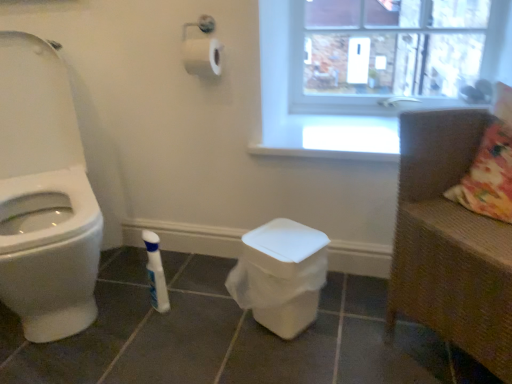
Question: Can you confirm if white glossy bottle at lower center is smaller than transparent plastic window screen at upper right?

Choices:
 (A) no
 (B) yes

Answer: (B)

Question: From the image's perspective, does white glossy bottle at lower center appear higher than transparent plastic window screen at upper right?

Choices:
 (A) yes
 (B) no

Answer: (B)

Question: Is transparent plastic window screen at upper right a part of white glossy bottle at lower center?

Choices:
 (A) yes
 (B) no

Answer: (B)

Question: From a real-world perspective, does white glossy bottle at lower center stand above transparent plastic window screen at upper right?

Choices:
 (A) yes
 (B) no

Answer: (B)

Question: Does white glossy bottle at lower center have a greater width compared to transparent plastic window screen at upper right?

Choices:
 (A) yes
 (B) no

Answer: (A)

Question: From the image's perspective, does white glossy bottle at lower center appear lower than transparent plastic window screen at upper right?

Choices:
 (A) no
 (B) yes

Answer: (B)

Question: Can you confirm if white glossy bottle at lower center is thinner than brown woven armchair at right?

Choices:
 (A) yes
 (B) no

Answer: (A)

Question: Is white glossy bottle at lower center not within brown woven armchair at right?

Choices:
 (A) no
 (B) yes

Answer: (B)

Question: Is white glossy bottle at lower center in contact with brown woven armchair at right?

Choices:
 (A) yes
 (B) no

Answer: (B)

Question: Is white glossy bottle at lower center in front of brown woven armchair at right?

Choices:
 (A) yes
 (B) no

Answer: (B)

Question: Considering the relative sizes of white glossy bottle at lower center and brown woven armchair at right in the image provided, is white glossy bottle at lower center smaller than brown woven armchair at right?

Choices:
 (A) yes
 (B) no

Answer: (A)

Question: From a real-world perspective, is white glossy bottle at lower center on brown woven armchair at right?

Choices:
 (A) yes
 (B) no

Answer: (B)

Question: Is brown woven armchair at right positioned far away from transparent plastic window screen at upper right?

Choices:
 (A) no
 (B) yes

Answer: (A)